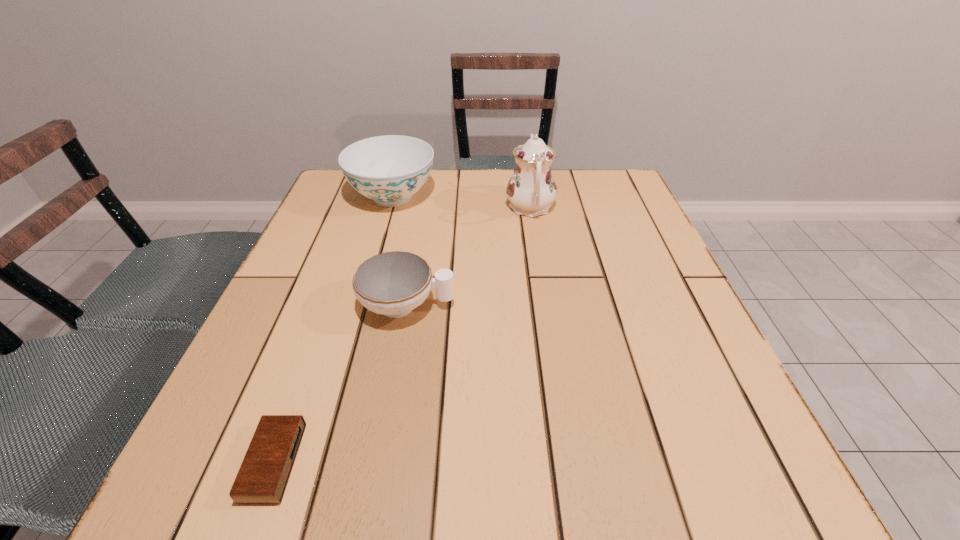
You are a GUI agent. You are given a task and a screenshot of the screen. Output one action in this format:
    pyautogui.click(x=<x>, y=<y>)
    Task: Click on the chinaware that is the second closest to the rightmost chinaware
    
    Given the screenshot: What is the action you would take?
    pyautogui.click(x=394, y=283)

Identify the location of chinaware that is the third closest one to the alarm clock. (531, 190).

Where is `free space in the image that satisfies the following two spatial constraints: 1. on the front side of the third shortest object; 2. on the front face of the nearest object`? free space in the image that satisfies the following two spatial constraints: 1. on the front side of the third shortest object; 2. on the front face of the nearest object is located at coordinates (317, 462).

Find the location of `vacant space that satisfies the following two spatial constraints: 1. on the front side of the rightmost object; 2. on the side with the handle of the shortest chinaware`. vacant space that satisfies the following two spatial constraints: 1. on the front side of the rightmost object; 2. on the side with the handle of the shortest chinaware is located at coordinates (546, 305).

Find the location of a particular element. This screenshot has height=540, width=960. free region that satisfies the following two spatial constraints: 1. on the front side of the third shortest object; 2. on the front face of the nearest object is located at coordinates (317, 462).